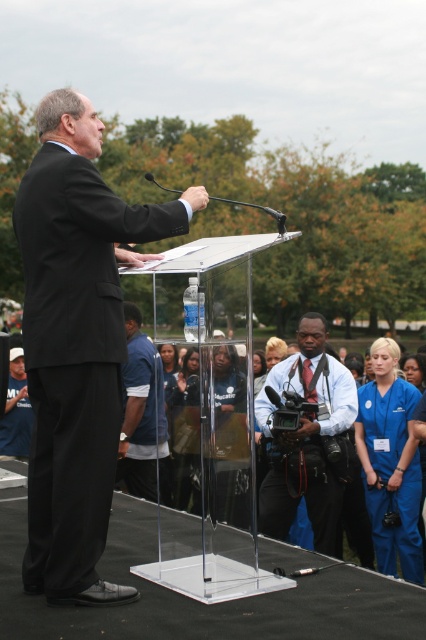
Question: Which of the following is the closest to the observer?

Choices:
 (A) blue fabric shirt at center
 (B) matte black suit at center
 (C) blue scrubs at right
 (D) blue shirt at center

Answer: (B)

Question: Which of the following is the farthest from the observer?

Choices:
 (A) blue shirt at center
 (B) matte black suit at center

Answer: (A)

Question: Which object is closer to the camera taking this photo?

Choices:
 (A) blue scrubs at right
 (B) matte black suit at center

Answer: (B)

Question: Does blue scrubs at right come in front of blue fabric shirt at center?

Choices:
 (A) yes
 (B) no

Answer: (B)

Question: Is blue shirt at center to the right of blue scrubs at right from the viewer's perspective?

Choices:
 (A) yes
 (B) no

Answer: (B)

Question: Can you confirm if matte black suit at center is positioned above blue fabric shirt at center?

Choices:
 (A) no
 (B) yes

Answer: (B)